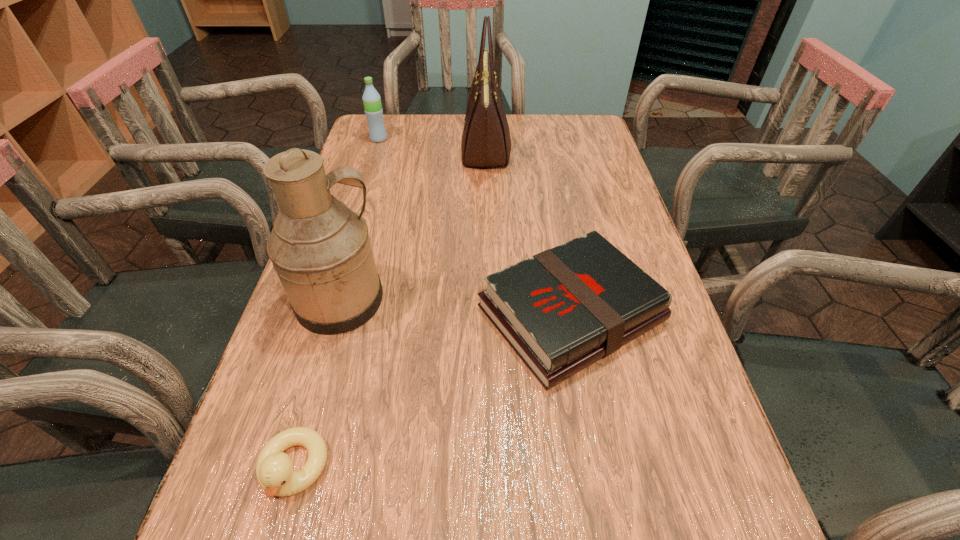
Select which object is the second closest to the nearest object. Please provide its 2D coordinates. Your answer should be formatted as a tuple, i.e. [(x, y)], where the tuple contains the x and y coordinates of a point satisfying the conditions above.

[(561, 310)]

Point out which object is positioned as the nearest to the pitcher. Please provide its 2D coordinates. Your answer should be formatted as a tuple, i.e. [(x, y)], where the tuple contains the x and y coordinates of a point satisfying the conditions above.

[(561, 310)]

Where is `vacant space that satisfies the following two spatial constraints: 1. on the front side of the pitcher; 2. on the left side of the hardback book`? vacant space that satisfies the following two spatial constraints: 1. on the front side of the pitcher; 2. on the left side of the hardback book is located at coordinates (338, 314).

Locate an element on the screen. This screenshot has height=540, width=960. vacant space that satisfies the following two spatial constraints: 1. on the front-facing side of the handbag; 2. on the front side of the pitcher is located at coordinates (489, 301).

Find the location of a particular element. This screenshot has height=540, width=960. vacant space that satisfies the following two spatial constraints: 1. on the front-facing side of the handbag; 2. at the beak of the nearest object is located at coordinates (492, 469).